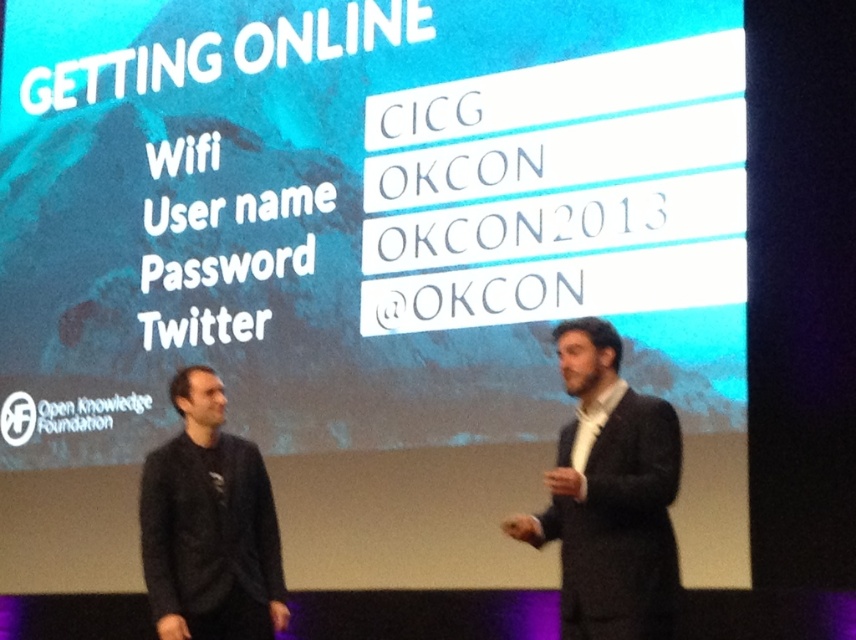
Is white matte projection screen at upper center taller than black wool suit at right?

Yes, white matte projection screen at upper center is taller than black wool suit at right.

Does point (169, 195) come in front of point (559, 529)?

No, (169, 195) is further to viewer.

You are a GUI agent. You are given a task and a screenshot of the screen. Output one action in this format:
    pyautogui.click(x=<x>, y=<y>)
    Task: Click on the white matte projection screen at upper center
    The height and width of the screenshot is (640, 856).
    Given the screenshot: What is the action you would take?
    pyautogui.click(x=361, y=214)

Can you confirm if black wool suit at right is smaller than black matte sweater at left?

Correct, black wool suit at right occupies less space than black matte sweater at left.

The width and height of the screenshot is (856, 640). What do you see at coordinates (609, 497) in the screenshot?
I see `black wool suit at right` at bounding box center [609, 497].

You are a GUI agent. You are given a task and a screenshot of the screen. Output one action in this format:
    pyautogui.click(x=<x>, y=<y>)
    Task: Click on the black wool suit at right
    The height and width of the screenshot is (640, 856).
    Given the screenshot: What is the action you would take?
    pyautogui.click(x=609, y=497)

Between point (349, 339) and point (195, 516), which one is positioned behind?

Positioned behind is point (349, 339).

Does white matte projection screen at upper center appear over black matte sweater at left?

Yes.

Is point (591, 268) positioned behind point (201, 557)?

That is True.

At what (x,y) coordinates should I click in order to perform the action: click on white matte projection screen at upper center. Please return your answer as a coordinate pair (x, y). The height and width of the screenshot is (640, 856). Looking at the image, I should click on (361, 214).